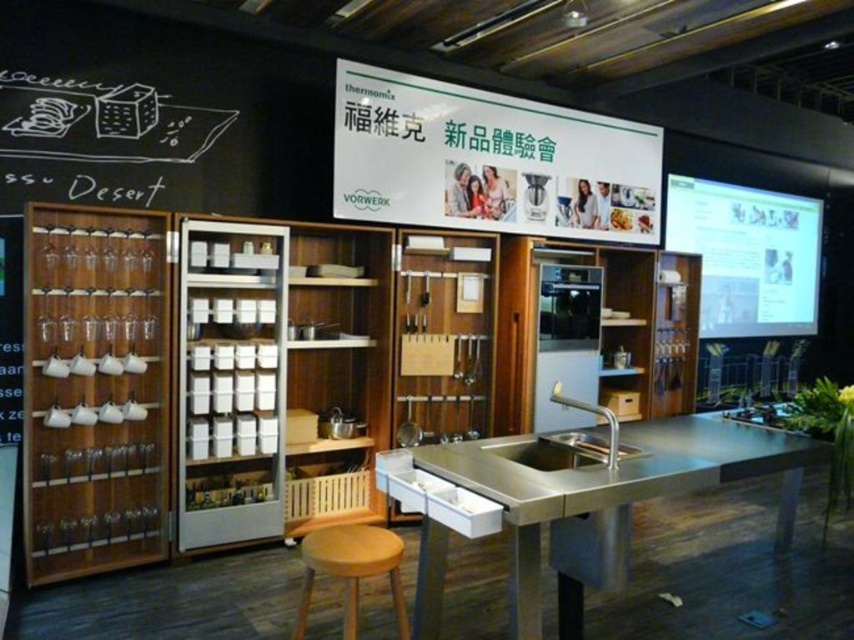
Question: From the image, what is the correct spatial relationship of stainless steel sink at center in relation to light brown wooden stool at center?

Choices:
 (A) above
 (B) below

Answer: (A)

Question: Does matte white screen at upper right appear under satin nickel sink at center?

Choices:
 (A) yes
 (B) no

Answer: (B)

Question: Which point is farther to the camera?

Choices:
 (A) coord(331,550)
 (B) coord(597,173)
 (C) coord(562,403)

Answer: (B)

Question: Does white paper at upper center have a greater width compared to light brown wooden stool at center?

Choices:
 (A) no
 (B) yes

Answer: (B)

Question: Which of these objects is positioned farthest from the light brown wooden stool at center?

Choices:
 (A) satin nickel sink at center
 (B) stainless steel sink at center
 (C) matte white screen at upper right

Answer: (C)

Question: Among these objects, which one is farthest from the camera?

Choices:
 (A) satin nickel sink at center
 (B) matte white screen at upper right
 (C) stainless steel sink at center
 (D) white paper at upper center

Answer: (B)